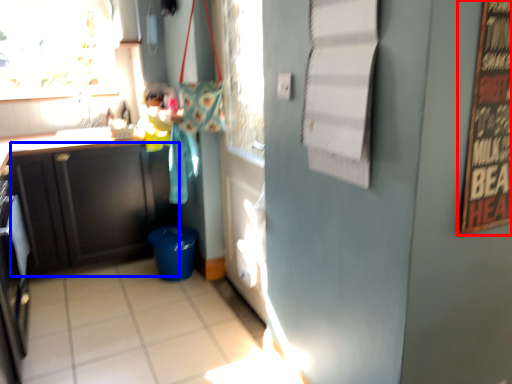
Question: Among these objects, which one is nearest to the camera, bulletin board (highlighted by a red box) or cabinetry (highlighted by a blue box)?

Choices:
 (A) bulletin board
 (B) cabinetry

Answer: (A)